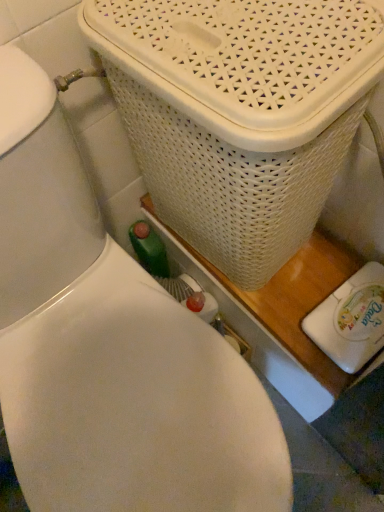
Question: Can you confirm if white plastic toilet brush at lower right is taller than white woven basket at upper right?

Choices:
 (A) yes
 (B) no

Answer: (B)

Question: From the image's perspective, does white plastic toilet brush at lower right appear higher than white woven basket at upper right?

Choices:
 (A) no
 (B) yes

Answer: (A)

Question: Is white plastic toilet brush at lower right smaller than white woven basket at upper right?

Choices:
 (A) no
 (B) yes

Answer: (B)

Question: From a real-world perspective, is white plastic toilet brush at lower right on top of white woven basket at upper right?

Choices:
 (A) no
 (B) yes

Answer: (A)

Question: Could you tell me if white plastic toilet brush at lower right is facing white woven basket at upper right?

Choices:
 (A) no
 (B) yes

Answer: (A)

Question: Can you confirm if white plastic toilet brush at lower right is wider than white woven basket at upper right?

Choices:
 (A) no
 (B) yes

Answer: (A)

Question: From a real-world perspective, is white woven basket at upper right located higher than white plastic toilet brush at lower right?

Choices:
 (A) no
 (B) yes

Answer: (B)

Question: Considering the relative positions of white woven basket at upper right and white plastic toilet brush at lower right in the image provided, is white woven basket at upper right to the right of white plastic toilet brush at lower right from the viewer's perspective?

Choices:
 (A) no
 (B) yes

Answer: (A)

Question: Can you confirm if white woven basket at upper right is thinner than white plastic toilet brush at lower right?

Choices:
 (A) yes
 (B) no

Answer: (B)

Question: Is white woven basket at upper right facing towards white plastic toilet brush at lower right?

Choices:
 (A) no
 (B) yes

Answer: (A)

Question: From a real-world perspective, does white woven basket at upper right sit lower than white plastic toilet brush at lower right?

Choices:
 (A) no
 (B) yes

Answer: (A)

Question: Is white woven basket at upper right shorter than white plastic toilet brush at lower right?

Choices:
 (A) no
 (B) yes

Answer: (A)

Question: Looking at the image, does white plastic toilet brush at lower right seem bigger or smaller compared to white woven basket at upper right?

Choices:
 (A) small
 (B) big

Answer: (A)